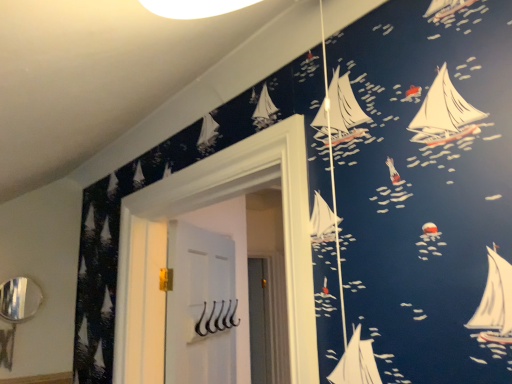
Question: From the image's perspective, is white matte hooks at center positioned above or below silver metallic mirror at lower left?

Choices:
 (A) above
 (B) below

Answer: (B)

Question: From a real-world perspective, is white matte hooks at center above or below silver metallic mirror at lower left?

Choices:
 (A) above
 (B) below

Answer: (B)

Question: Considering the positions of point 164,365 and point 9,312, is point 164,365 closer or farther from the camera than point 9,312?

Choices:
 (A) closer
 (B) farther

Answer: (A)

Question: Considering the relative positions of silver metallic mirror at lower left and white matte hooks at center in the image provided, is silver metallic mirror at lower left to the left or to the right of white matte hooks at center?

Choices:
 (A) left
 (B) right

Answer: (A)

Question: In the image, is silver metallic mirror at lower left positioned in front of or behind white matte hooks at center?

Choices:
 (A) behind
 (B) front

Answer: (A)

Question: Does point (27, 283) appear closer or farther from the camera than point (192, 365)?

Choices:
 (A) farther
 (B) closer

Answer: (A)

Question: Looking at their shapes, would you say silver metallic mirror at lower left is wider or thinner than white matte hooks at center?

Choices:
 (A) wide
 (B) thin

Answer: (B)